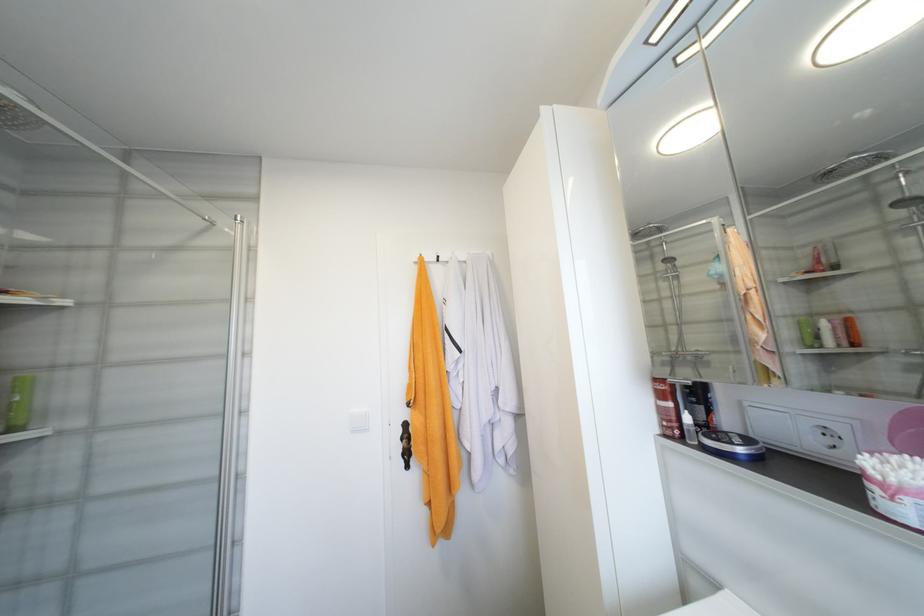
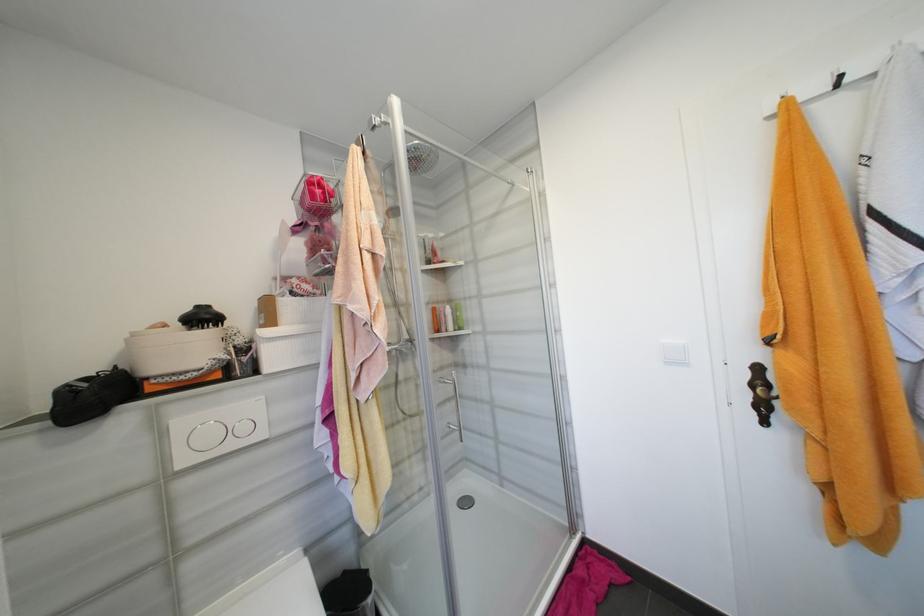
Find the pixel in the second image that matches point 411,426 in the first image.

(763, 370)